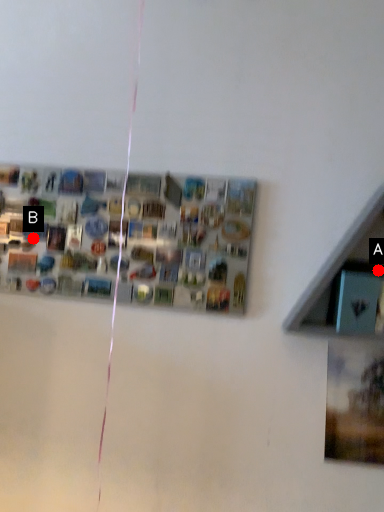
Question: Two points are circled on the image, labeled by A and B beside each circle. Which point is closer to the camera taking this photo?

Choices:
 (A) A is closer
 (B) B is closer

Answer: (A)